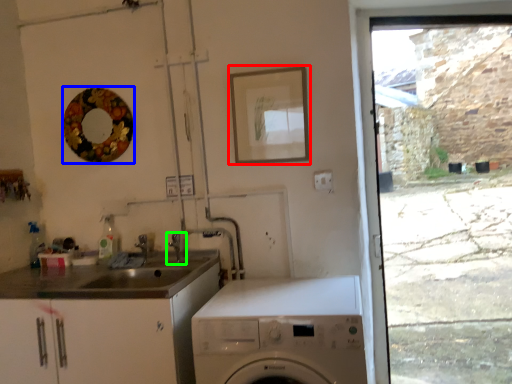
Question: Estimate the real-world distances between objects in this image. Which object is closer to picture frame (highlighted by a red box), mirror (highlighted by a blue box) or tap (highlighted by a green box)?

Choices:
 (A) mirror
 (B) tap

Answer: (A)